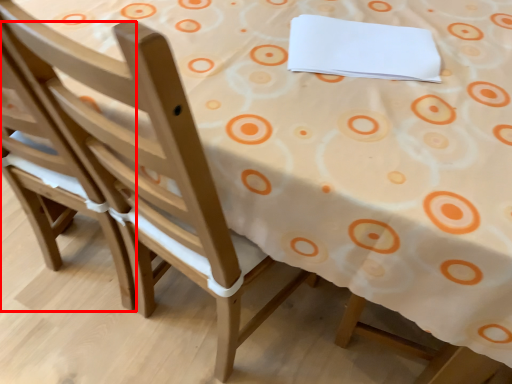
Question: Observing the image, what is the correct spatial positioning of chair (annotated by the red box) in reference to notepad?

Choices:
 (A) left
 (B) right

Answer: (A)